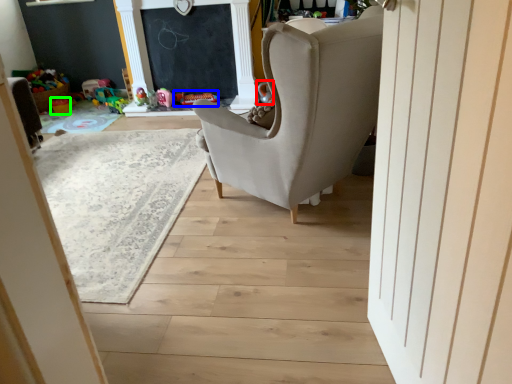
Question: Based on their relative distances, which object is farther from toy (highlighted by a red box)? Choose from toy (highlighted by a blue box) and toy (highlighted by a green box).

Choices:
 (A) toy
 (B) toy

Answer: (B)